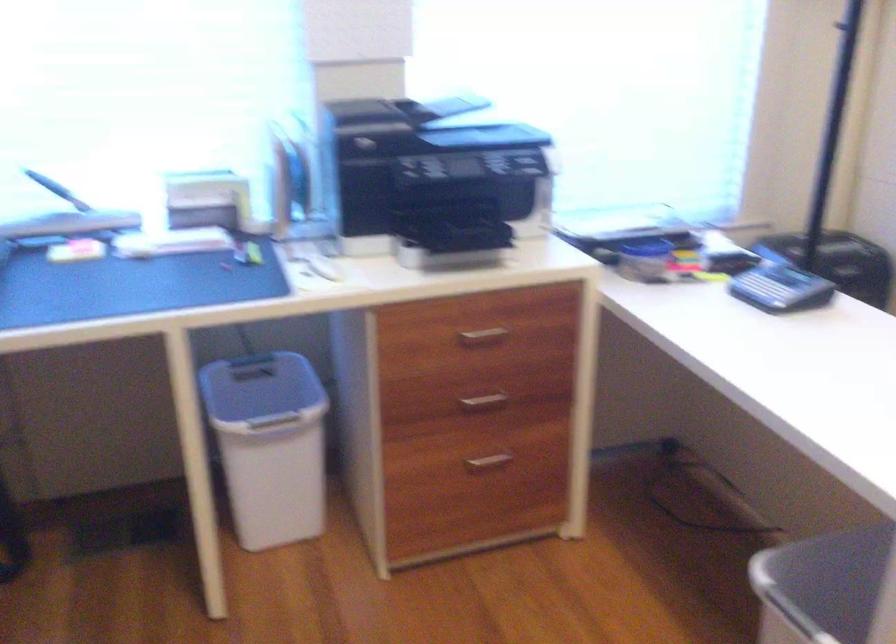
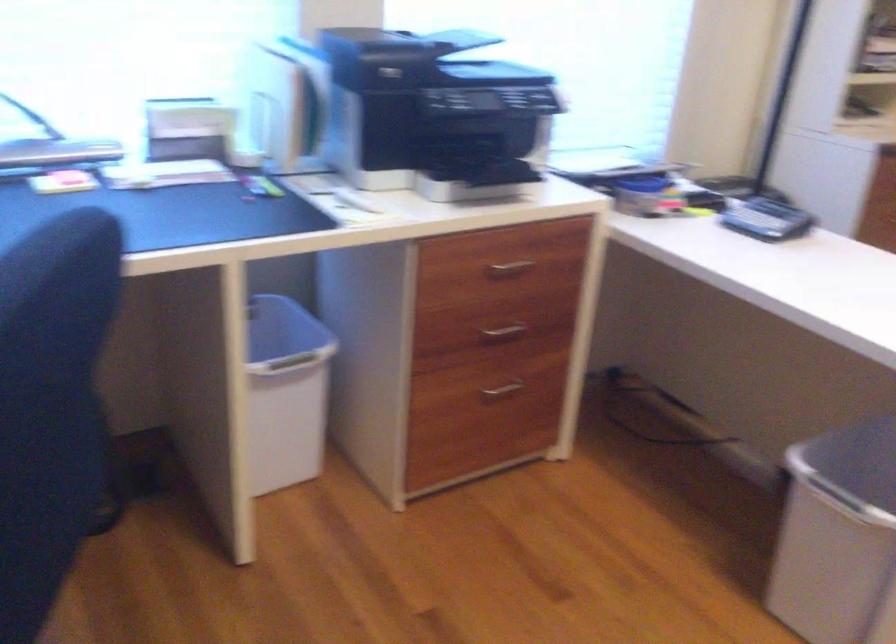
Question: The images are taken continuously from a first-person perspective. In which direction are you moving?

Choices:
 (A) Left
 (B) Right
 (C) Forward
 (D) Backward

Answer: (A)